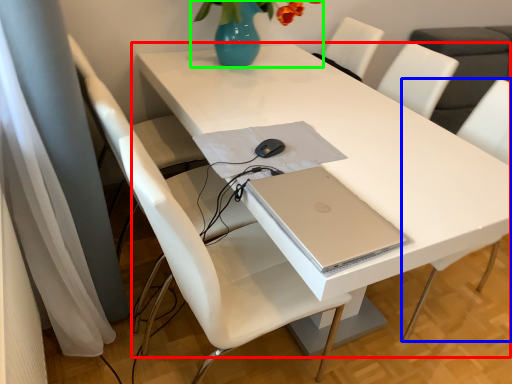
Question: Considering the real-world distances, which object is farthest from table (highlighted by a red box)? chair (highlighted by a blue box) or floral arrangement (highlighted by a green box)?

Choices:
 (A) chair
 (B) floral arrangement

Answer: (A)